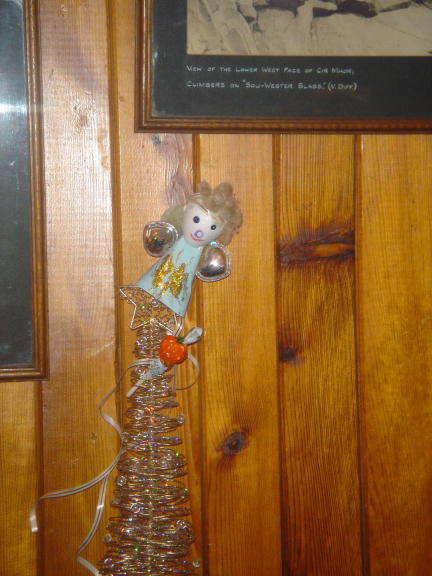
Locate an element on the screen. spiral wire christmas tree is located at coordinates (151, 486).